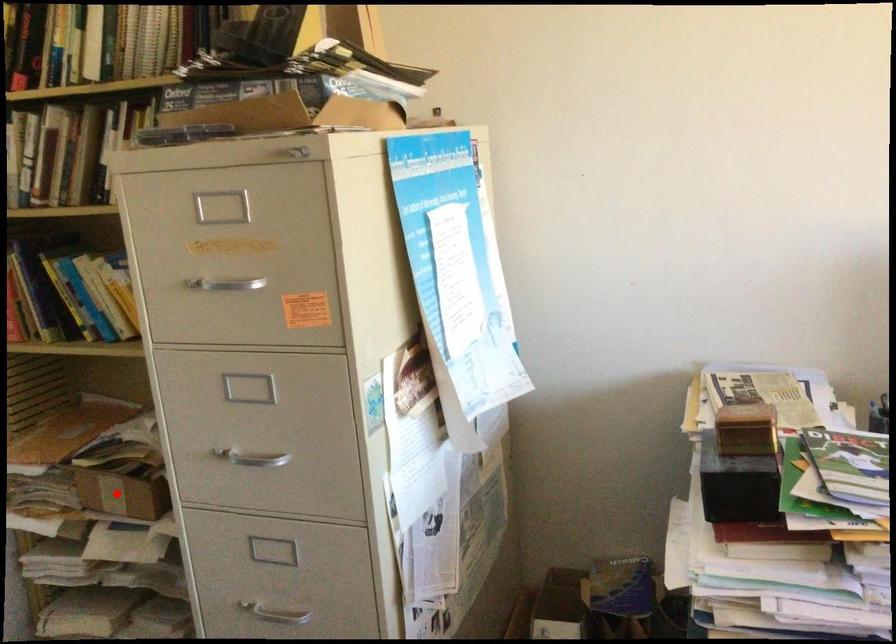
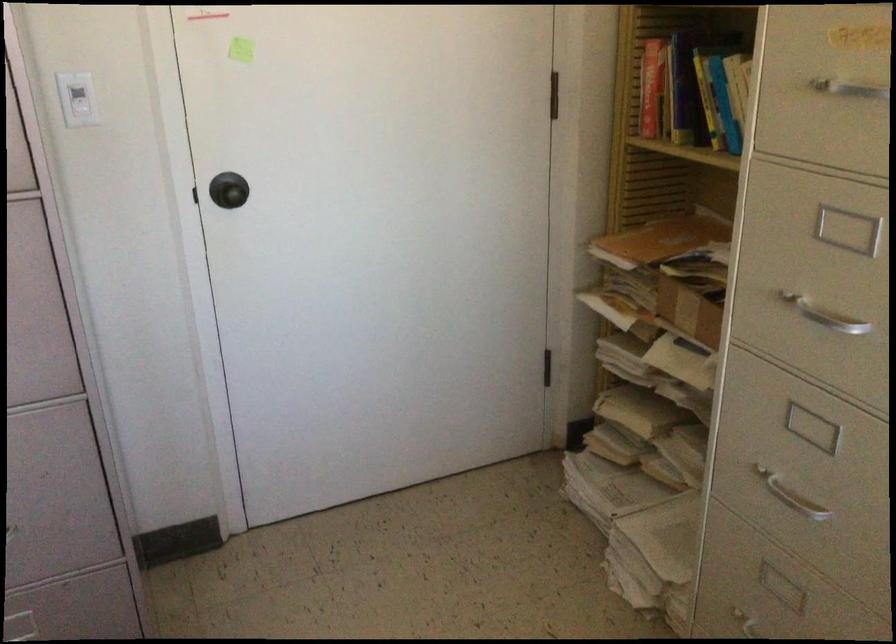
Locate, in the second image, the point that corresponds to the highlighted location in the first image.

(688, 310)